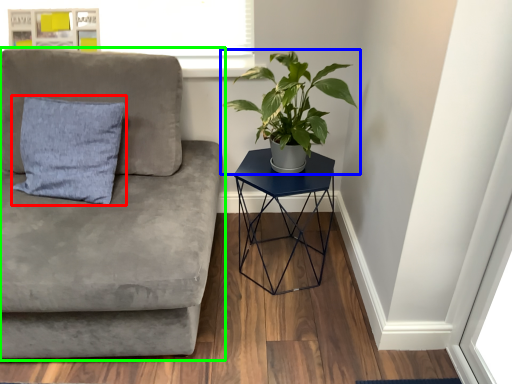
Question: Based on their relative distances, which object is nearer to pillow (highlighted by a red box)? Choose from houseplant (highlighted by a blue box) and studio couch (highlighted by a green box).

Choices:
 (A) houseplant
 (B) studio couch

Answer: (B)